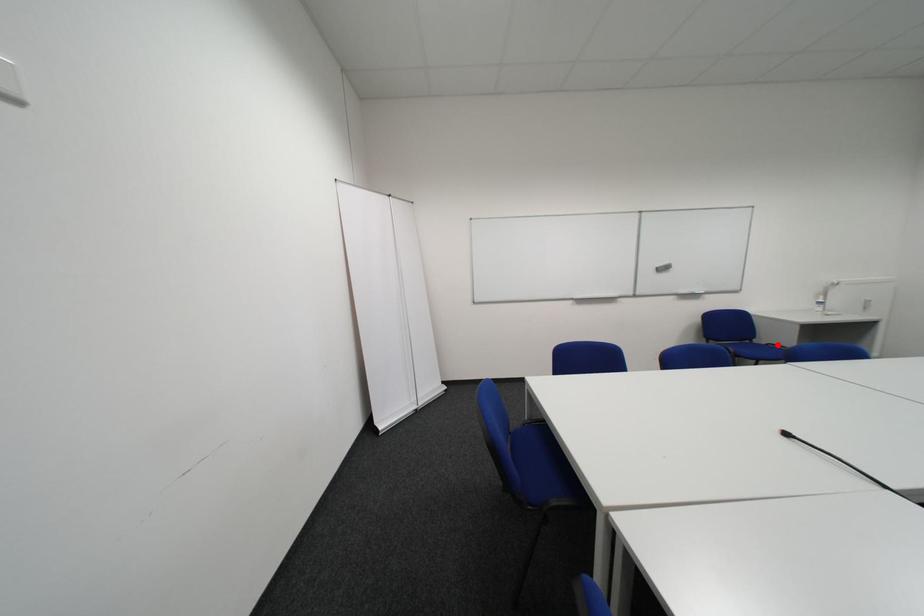
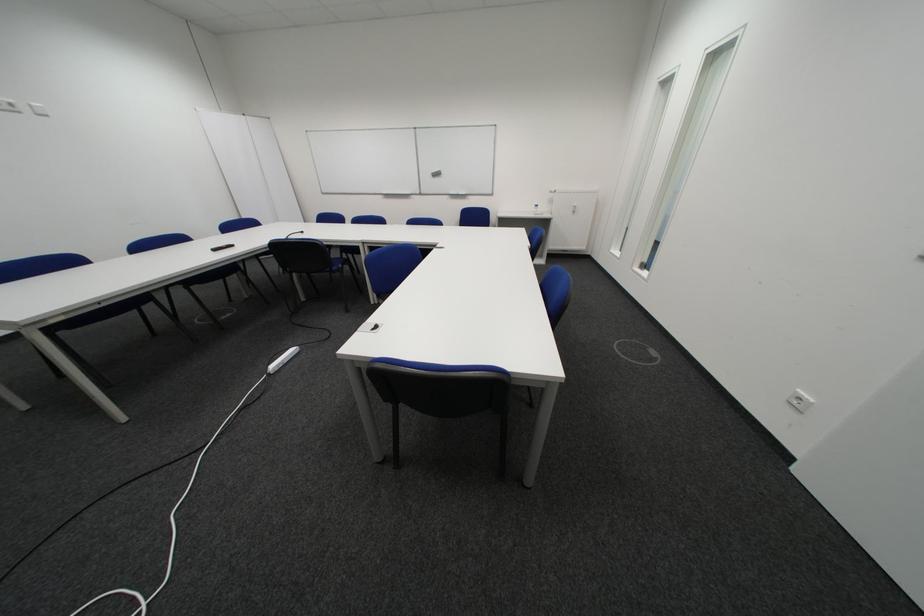
Question: I am providing you with two images of the same scene from different viewpoints. A red point is marked on the first image. Can you still see the location of the red point in image 2?

Choices:
 (A) Yes
 (B) No

Answer: (B)